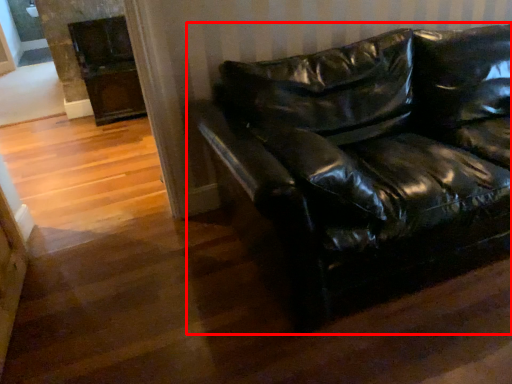
Question: Considering the relative positions of studio couch (annotated by the red box) and fireplace in the image provided, where is studio couch (annotated by the red box) located with respect to the staircase?

Choices:
 (A) left
 (B) right

Answer: (B)